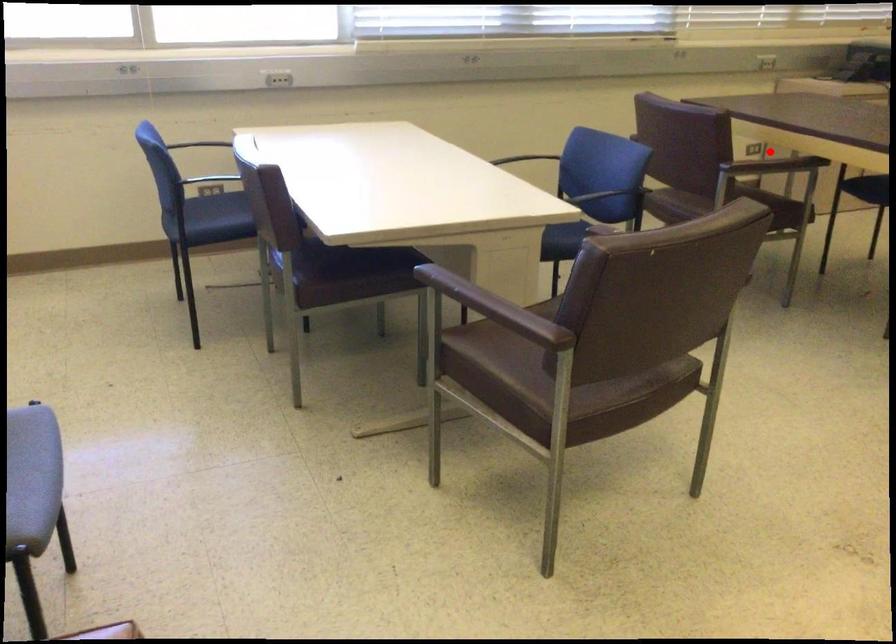
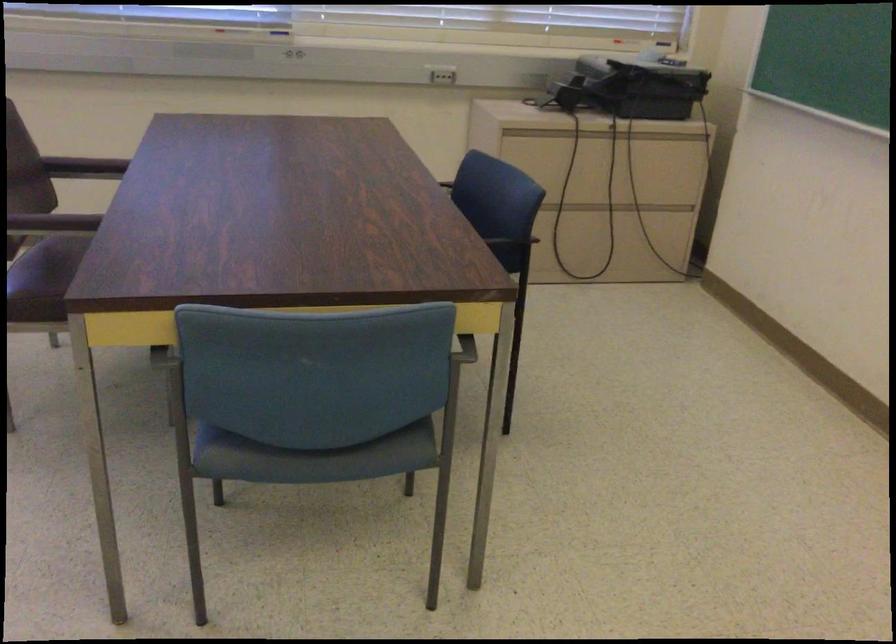
Question: I am providing you with two images of the same scene from different viewpoints. A red point is marked on the first image. Is the red point's position out of view in image 2?

Choices:
 (A) Yes
 (B) No

Answer: (A)